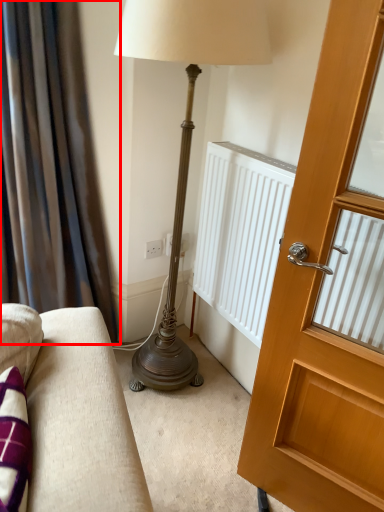
Question: From the image, what is the correct spatial relationship of curtain (annotated by the red box) in relation to door?

Choices:
 (A) left
 (B) right

Answer: (A)